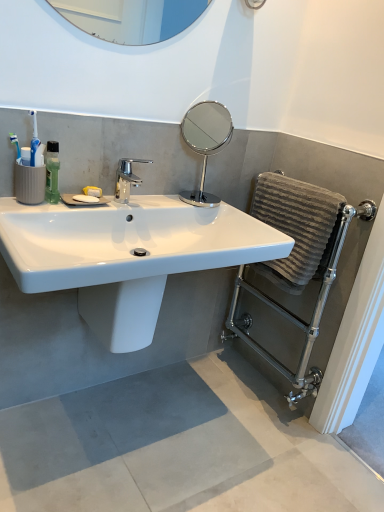
Identify the location of free space above gray concrete floor at lower center (from a real-world perspective). The width and height of the screenshot is (384, 512). (196, 444).